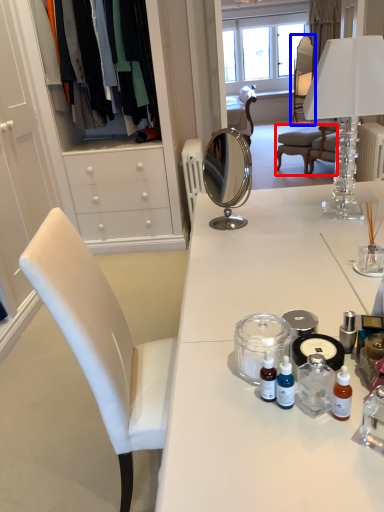
Question: Which of the following is the closest to the observer, chair (highlighted by a red box) or chair (highlighted by a blue box)?

Choices:
 (A) chair
 (B) chair

Answer: (A)